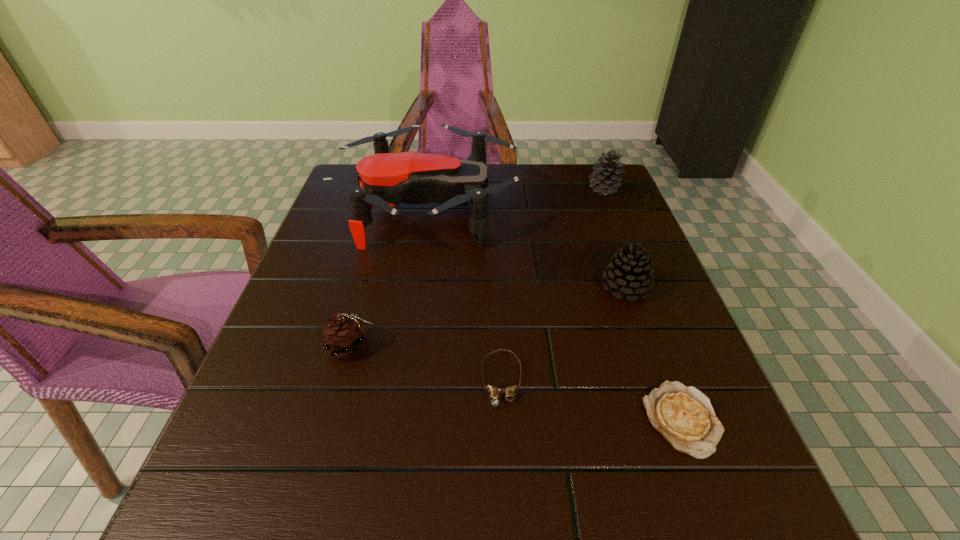
Where is `the tallest object`? The image size is (960, 540). the tallest object is located at coordinates (386, 179).

You are a GUI agent. You are given a task and a screenshot of the screen. Output one action in this format:
    pyautogui.click(x=<x>, y=<y>)
    Task: Click on the farthest pinecone
    This screenshot has width=960, height=540.
    Given the screenshot: What is the action you would take?
    pyautogui.click(x=605, y=181)

This screenshot has width=960, height=540. Identify the location of the second nearest pinecone. (629, 273).

Image resolution: width=960 pixels, height=540 pixels. Identify the location of the shortest pinecone. (344, 335).

The image size is (960, 540). In order to click on the nearest pinecone in this screenshot , I will do `click(344, 335)`.

Where is `the second shortest object`? The image size is (960, 540). the second shortest object is located at coordinates (494, 392).

You are a GUI agent. You are given a task and a screenshot of the screen. Output one action in this format:
    pyautogui.click(x=<x>, y=<y>)
    Task: Click on the quiche
    The width and height of the screenshot is (960, 540).
    Given the screenshot: What is the action you would take?
    pyautogui.click(x=684, y=416)

The image size is (960, 540). In order to click on free space located on the camera side of the tallest object in this screenshot , I will do `click(630, 207)`.

Locate an element on the screen. The image size is (960, 540). vacant position located on the front of the farthest pinecone is located at coordinates (648, 299).

The height and width of the screenshot is (540, 960). I want to click on vacant space located at the narrow end of the second nearest pinecone, so click(x=708, y=523).